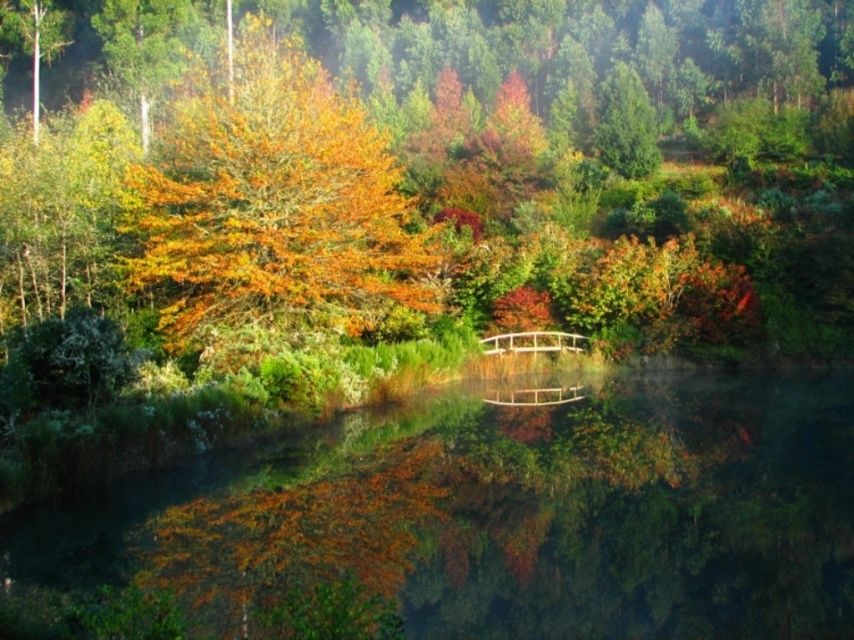
Is point (168, 333) less distant than point (597, 113)?

That is True.

Does orange matte tree at center appear on the right side of green matte tree at upper right?

Incorrect, orange matte tree at center is not on the right side of green matte tree at upper right.

The height and width of the screenshot is (640, 854). Describe the element at coordinates (273, 204) in the screenshot. I see `orange matte tree at center` at that location.

At what (x,y) coordinates should I click in order to perform the action: click on orange matte tree at center. Please return your answer as a coordinate pair (x, y). Image resolution: width=854 pixels, height=640 pixels. Looking at the image, I should click on (273, 204).